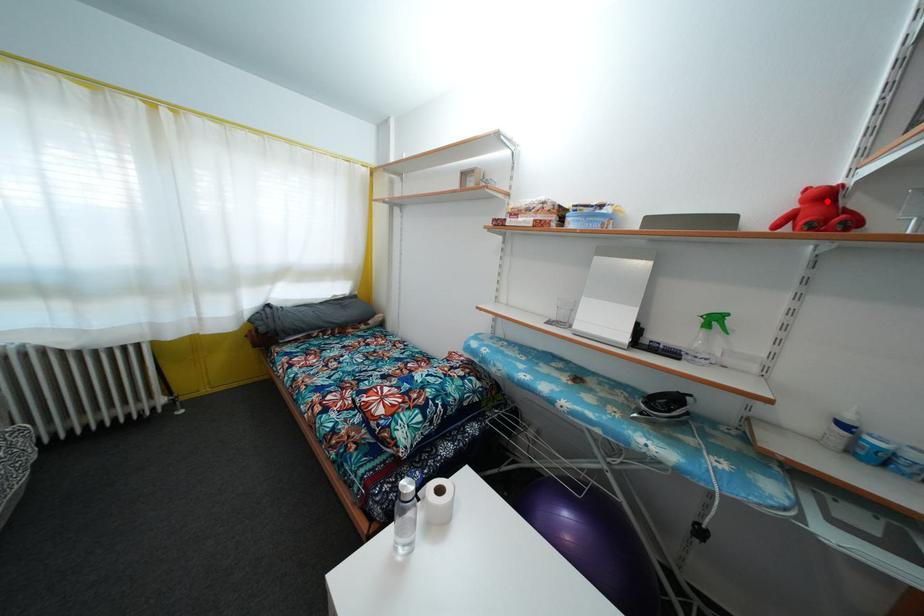
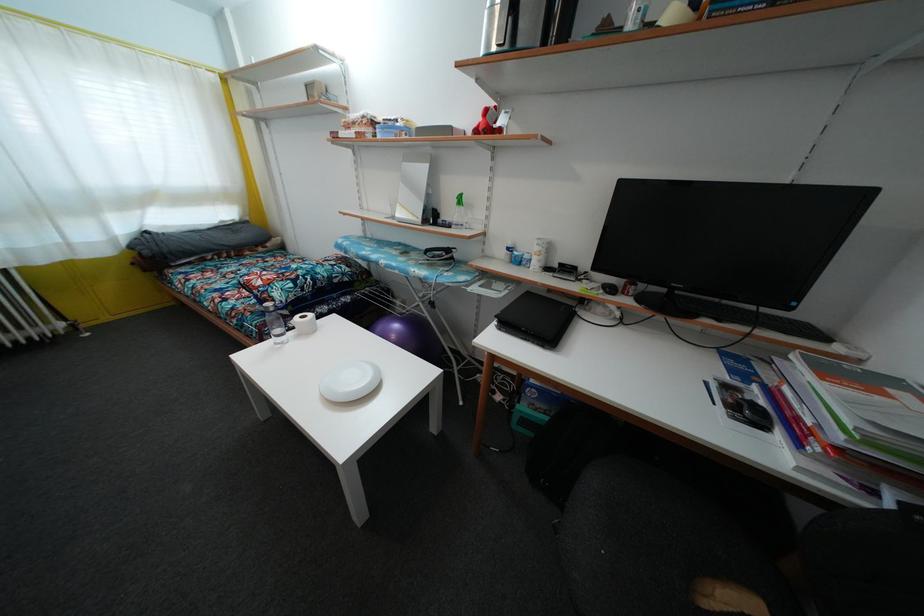
In the second image, find the point that corresponds to the highlighted location in the first image.

(490, 119)